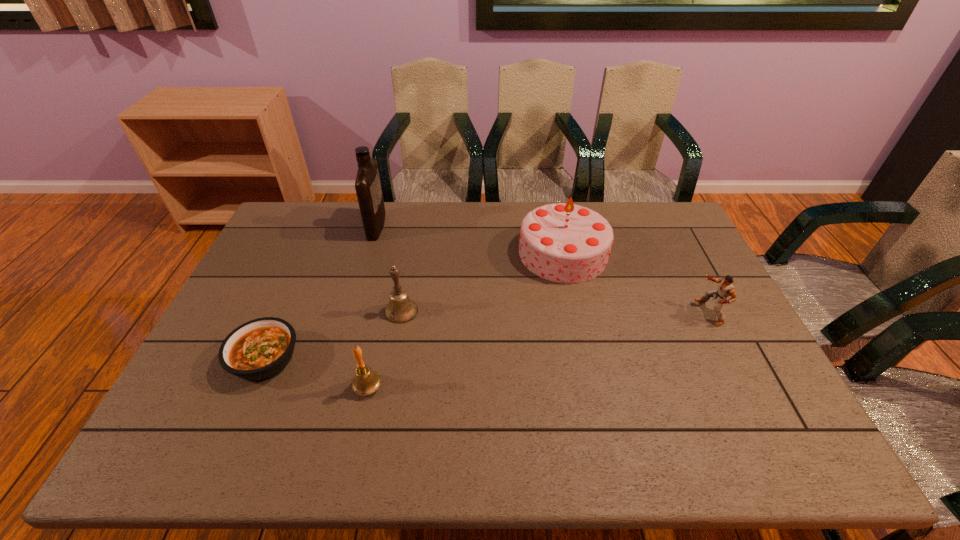
The height and width of the screenshot is (540, 960). I want to click on vacant space located 0.100m on the front of the second object from right to left, so pyautogui.click(x=575, y=307).

You are a GUI agent. You are given a task and a screenshot of the screen. Output one action in this format:
    pyautogui.click(x=<x>, y=<y>)
    Task: Click on the vacant space situated on the back of the farther bell
    
    Given the screenshot: What is the action you would take?
    pyautogui.click(x=409, y=266)

In order to click on free space located 0.400m on the left of the nearer bell in this screenshot , I will do `click(194, 387)`.

At what (x,y) coordinates should I click in order to perform the action: click on vacant space situated on the front-facing side of the rightmost object. Please return your answer as a coordinate pair (x, y). The height and width of the screenshot is (540, 960). Looking at the image, I should click on (593, 312).

Find the location of a particular element. The height and width of the screenshot is (540, 960). vacant space located 0.240m on the front-facing side of the rightmost object is located at coordinates pyautogui.click(x=617, y=312).

This screenshot has width=960, height=540. In order to click on vacant region located on the front-facing side of the rightmost object in this screenshot , I will do `click(631, 312)`.

The width and height of the screenshot is (960, 540). I want to click on free space located 0.110m on the right of the stew, so click(x=342, y=359).

Locate an element on the screen. liquor that is at the far edge is located at coordinates (368, 188).

Where is `birthday cake located in the far edge section of the desktop`? This screenshot has height=540, width=960. birthday cake located in the far edge section of the desktop is located at coordinates (563, 242).

Find the location of a particular element. Image resolution: width=960 pixels, height=540 pixels. object that is at the left edge is located at coordinates (258, 350).